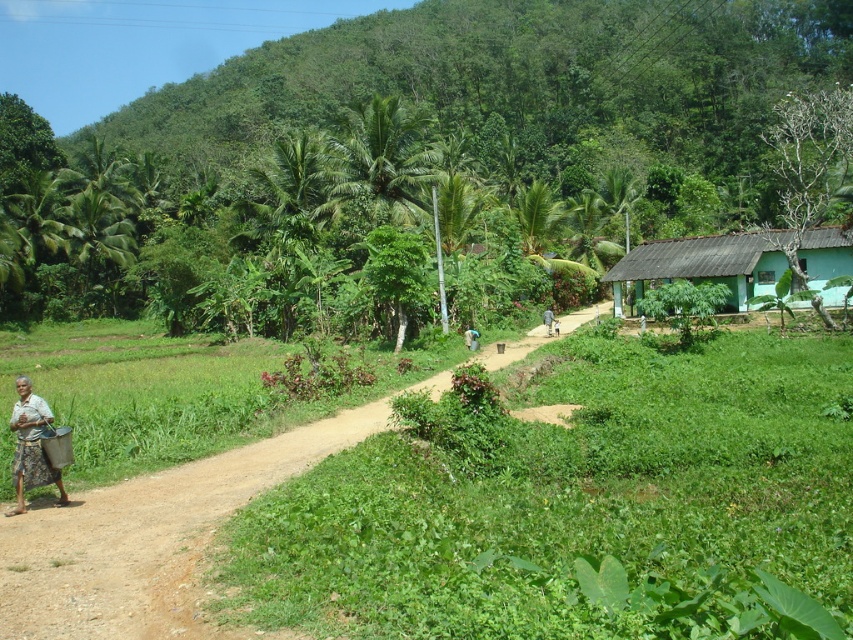
Between green leafy hillside at upper center and green matte hut at right, which one appears on the right side from the viewer's perspective?

green matte hut at right

Between point (830, 26) and point (724, 275), which one is positioned in front?

Point (724, 275) is more forward.

This screenshot has height=640, width=853. In order to click on green leafy hillside at upper center in this screenshot , I will do [520, 84].

Which is more to the left, green matte hut at right or brown fabric person at center?

From the viewer's perspective, brown fabric person at center appears more on the left side.

Which is in front, point (837, 294) or point (552, 326)?

Positioned in front is point (837, 294).

Is point (682, 262) more distant than point (546, 308)?

No, (682, 262) is in front of (546, 308).

Locate an element on the screen. green matte hut at right is located at coordinates (701, 264).

From the picture: Who is higher up, white cotton shirt at lower left or brown fabric person at center?

brown fabric person at center

Looking at this image, is white cotton shirt at lower left thinner than brown fabric person at center?

Yes.

Is point (51, 476) positioned behind point (550, 332)?

No, (51, 476) is in front of (550, 332).

You are a GUI agent. You are given a task and a screenshot of the screen. Output one action in this format:
    pyautogui.click(x=<x>, y=<y>)
    Task: Click on the white cotton shirt at lower left
    Image resolution: width=853 pixels, height=640 pixels.
    Given the screenshot: What is the action you would take?
    [x=32, y=445]